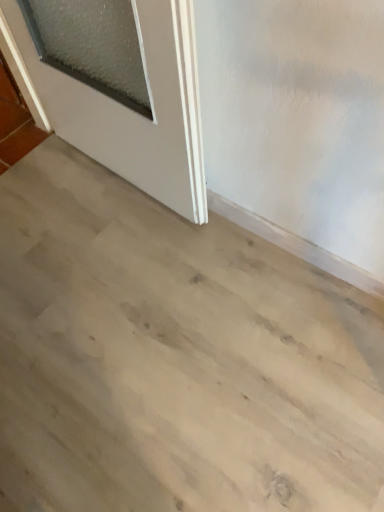
I want to click on unoccupied area in front of white glossy door at upper left, so click(x=123, y=281).